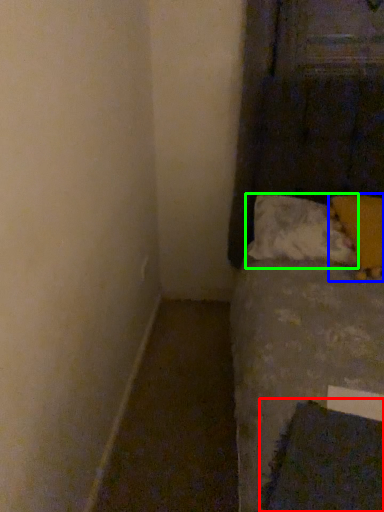
Question: Based on their relative distances, which object is nearer to sheet (highlighted by a red box)? Choose from pillow (highlighted by a blue box) and pillow (highlighted by a green box).

Choices:
 (A) pillow
 (B) pillow

Answer: (A)